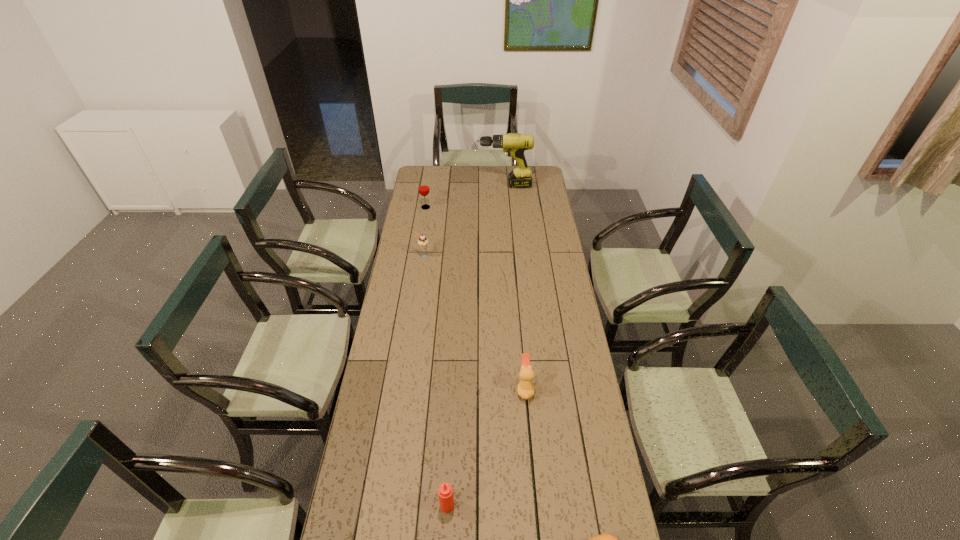
The width and height of the screenshot is (960, 540). What are the coordinates of `the tallest object` in the screenshot? It's located at (515, 144).

Find the location of a particular element. drill is located at coordinates (515, 144).

Where is `glass`? The height and width of the screenshot is (540, 960). glass is located at coordinates (423, 187).

Find the location of a particular element. icecream is located at coordinates (422, 241).

You are a GUI agent. You are given a task and a screenshot of the screen. Output one action in this format:
    pyautogui.click(x=<x>, y=<y>)
    Task: Click on the Tabasco sauce
    This screenshot has width=960, height=540.
    Given the screenshot: What is the action you would take?
    pyautogui.click(x=445, y=491)

The width and height of the screenshot is (960, 540). Identify the location of the third object from left to right. (445, 491).

Identify the location of the second shortest object. (525, 388).

Find the location of a particular element. The width and height of the screenshot is (960, 540). the fourth farthest object is located at coordinates (525, 388).

The height and width of the screenshot is (540, 960). I want to click on vacant area situated 0.310m on the handle side of the tallest object, so click(423, 186).

This screenshot has height=540, width=960. Find the location of `vacant space located on the handle side of the tallest object`. vacant space located on the handle side of the tallest object is located at coordinates (420, 186).